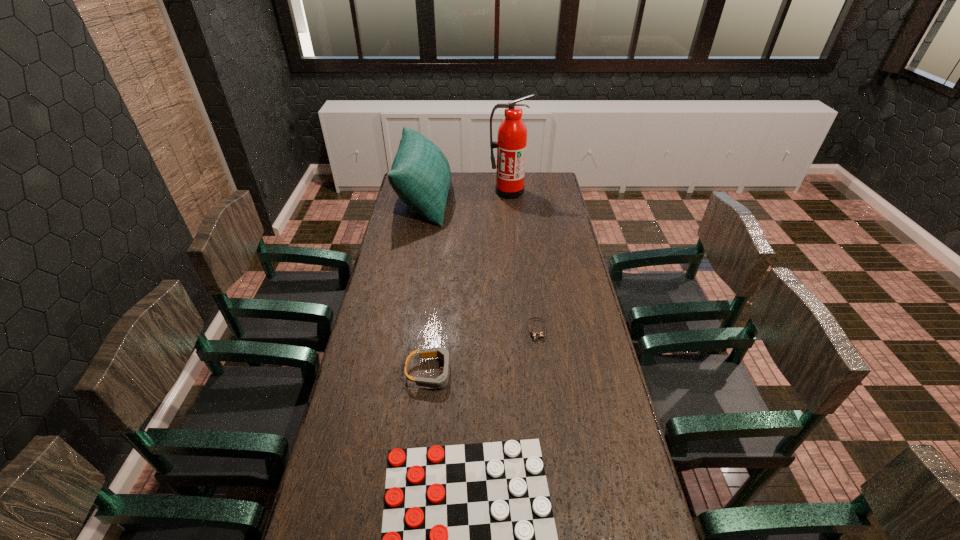
Locate an element on the screen. fire extinguisher is located at coordinates (511, 144).

This screenshot has height=540, width=960. I want to click on cushion, so click(x=420, y=175).

What are the coordinates of `the nearer goggles` in the screenshot? It's located at (440, 382).

Find the location of a particular element. This screenshot has width=960, height=540. the third tallest object is located at coordinates point(440,382).

The image size is (960, 540). I want to click on the shorter goggles, so click(x=534, y=335).

Identify the location of the farther goggles. The image size is (960, 540). (534, 335).

This screenshot has height=540, width=960. Identify the location of vacant position located 0.160m on the label side of the tallest object. (510, 216).

What are the coordinates of `vacant space located 0.300m on the front-facing side of the cushion` in the screenshot? It's located at (510, 200).

Find the location of a particular element. The width and height of the screenshot is (960, 540). free space located 0.330m on the front and back of the taller goggles is located at coordinates pyautogui.click(x=555, y=373).

Where is `vacant position located on the front lenses and sides of the farther goggles`? This screenshot has width=960, height=540. vacant position located on the front lenses and sides of the farther goggles is located at coordinates (540, 363).